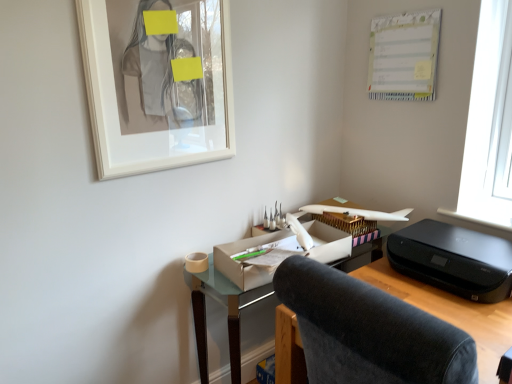
Question: Can you confirm if matte cardboard desk at center is shorter than black plastic printer at right?

Choices:
 (A) no
 (B) yes

Answer: (A)

Question: Would you say matte cardboard desk at center is a long distance from black plastic printer at right?

Choices:
 (A) no
 (B) yes

Answer: (A)

Question: Considering the relative sizes of matte cardboard desk at center and black plastic printer at right in the image provided, is matte cardboard desk at center thinner than black plastic printer at right?

Choices:
 (A) yes
 (B) no

Answer: (A)

Question: From the image's perspective, is matte cardboard desk at center beneath black plastic printer at right?

Choices:
 (A) yes
 (B) no

Answer: (A)

Question: Does matte cardboard desk at center contain black plastic printer at right?

Choices:
 (A) no
 (B) yes

Answer: (A)

Question: Is matte cardboard desk at center not within black plastic printer at right?

Choices:
 (A) no
 (B) yes

Answer: (B)

Question: Is white glossy picture frame at upper left further to camera compared to velvet dark gray chair at center?

Choices:
 (A) no
 (B) yes

Answer: (B)

Question: Can you confirm if white glossy picture frame at upper left is bigger than velvet dark gray chair at center?

Choices:
 (A) yes
 (B) no

Answer: (B)

Question: Is white glossy picture frame at upper left not within velvet dark gray chair at center?

Choices:
 (A) yes
 (B) no

Answer: (A)

Question: Is white glossy picture frame at upper left shorter than velvet dark gray chair at center?

Choices:
 (A) no
 (B) yes

Answer: (B)

Question: Is white glossy picture frame at upper left positioned before velvet dark gray chair at center?

Choices:
 (A) no
 (B) yes

Answer: (A)

Question: Is velvet dark gray chair at center a part of white glossy picture frame at upper left?

Choices:
 (A) yes
 (B) no

Answer: (B)

Question: Considering the relative sizes of black plastic printer at right and white glossy picture frame at upper left in the image provided, is black plastic printer at right wider than white glossy picture frame at upper left?

Choices:
 (A) yes
 (B) no

Answer: (A)